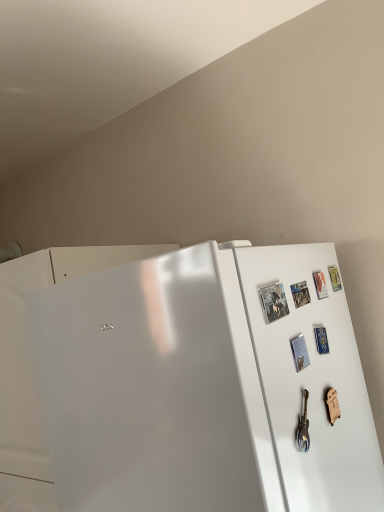
What do you see at coordinates (206, 384) in the screenshot? The height and width of the screenshot is (512, 384). I see `white glossy refrigerator at left` at bounding box center [206, 384].

In order to click on white glossy refrigerator at left in this screenshot , I will do `click(206, 384)`.

At what (x,y) coordinates should I click in order to perform the action: click on white glossy refrigerator at left. Please return your answer as a coordinate pair (x, y). Looking at the image, I should click on (206, 384).